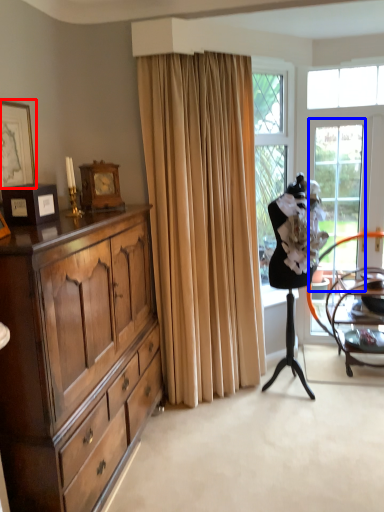
Question: Which object is closer to the camera taking this photo, picture frame (highlighted by a red box) or screen door (highlighted by a blue box)?

Choices:
 (A) picture frame
 (B) screen door

Answer: (A)